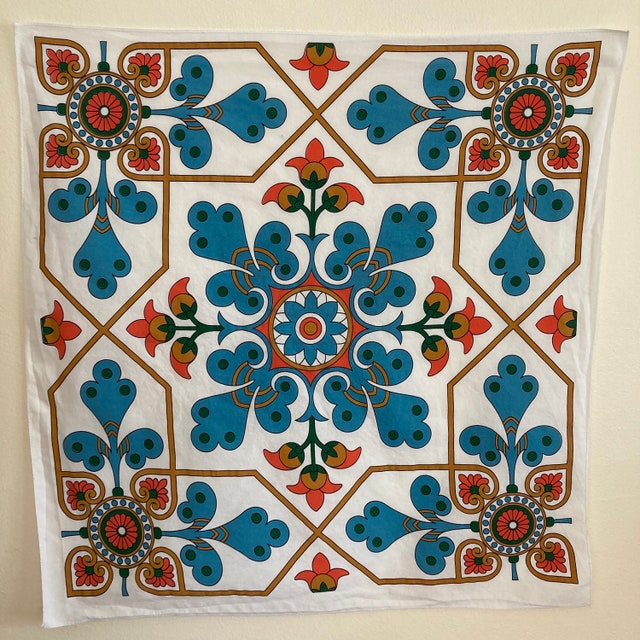
The width and height of the screenshot is (640, 640). Find the location of `decor`. decor is located at coordinates coord(313,324).